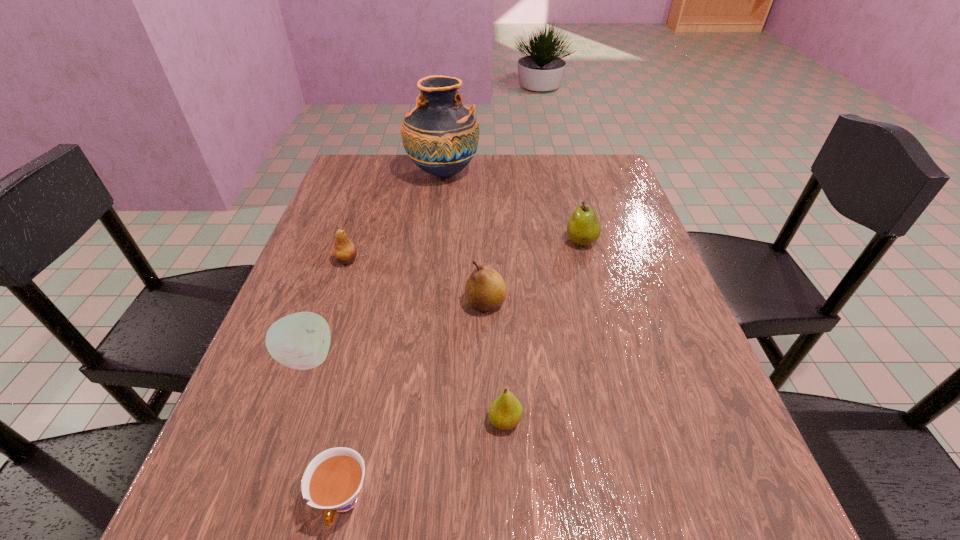
Where is `object that is the fifth closest to the second farthest pear`? object that is the fifth closest to the second farthest pear is located at coordinates (505, 413).

Where is `pear identified as the third closest to the apple`? This screenshot has width=960, height=540. pear identified as the third closest to the apple is located at coordinates (505, 413).

Where is `the second closest pear relative to the third farthest pear`? the second closest pear relative to the third farthest pear is located at coordinates (505, 413).

Locate an element on the screen. The height and width of the screenshot is (540, 960). free location that satisfies the following two spatial constraints: 1. on the front side of the rightmost pear; 2. on the left side of the tallest object is located at coordinates (435, 241).